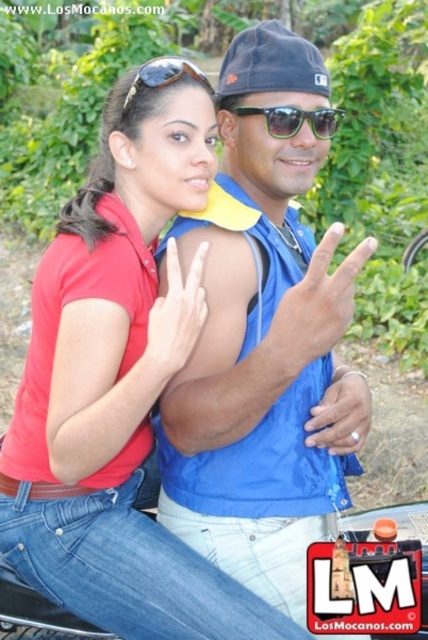
Question: Which is farther from the matte red polo shirt at center?

Choices:
 (A) matte black sunglasses at upper center
 (B) sunglasses at center
 (C) blue fabric vest at center

Answer: (B)

Question: Among these points, which one is farthest from the camera?

Choices:
 (A) (273, 116)
 (B) (134, 83)
 (C) (265, 220)
 (D) (166, 628)

Answer: (C)

Question: Can you confirm if matte red polo shirt at center is thinner than matte black sunglasses at upper center?

Choices:
 (A) no
 (B) yes

Answer: (A)

Question: Is blue fabric vest at center to the right of matte black sunglasses at upper center from the viewer's perspective?

Choices:
 (A) no
 (B) yes

Answer: (B)

Question: Which point is farther from the camera taking this photo?

Choices:
 (A) (71, 531)
 (B) (208, 83)
 (C) (222, 168)
 (D) (323, 138)

Answer: (C)

Question: Can you confirm if matte red polo shirt at center is wider than blue fabric vest at center?

Choices:
 (A) yes
 (B) no

Answer: (A)